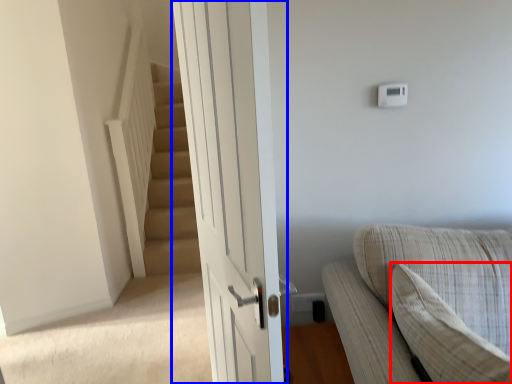
Question: Among these objects, which one is nearest to the camera, pillow (highlighted by a red box) or door (highlighted by a blue box)?

Choices:
 (A) pillow
 (B) door

Answer: (B)